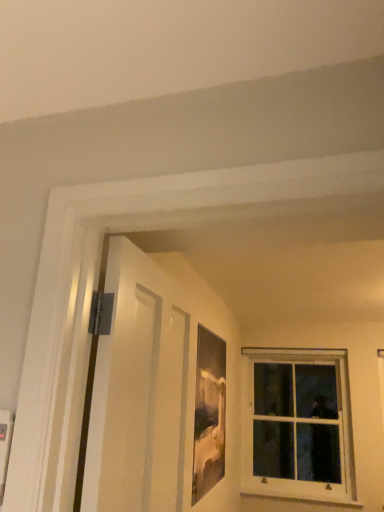
Describe the element at coordinates (297, 424) in the screenshot. The height and width of the screenshot is (512, 384). I see `white wood window at upper right` at that location.

Where is `white matte door at left`? white matte door at left is located at coordinates (138, 391).

Between matte wooden picture frame at center and white matte door at left, which one appears on the right side from the viewer's perspective?

Positioned to the right is matte wooden picture frame at center.

From the picture: From the image's perspective, is matte wooden picture frame at center located above or below white matte door at left?

matte wooden picture frame at center is situated lower than white matte door at left in the image.

Between matte wooden picture frame at center and white matte door at left, which one is positioned in front?

white matte door at left is in front.

From a real-world perspective, does matte wooden picture frame at center stand above white matte door at left?

No.

The width and height of the screenshot is (384, 512). In order to click on picture frame above the white wood window at upper right (from a real-world perspective) in this screenshot , I will do `click(209, 413)`.

Considering the positions of objects white wood window at upper right and matte wooden picture frame at center in the image provided, who is more to the left, white wood window at upper right or matte wooden picture frame at center?

From the viewer's perspective, matte wooden picture frame at center appears more on the left side.

Can you confirm if white wood window at upper right is bigger than matte wooden picture frame at center?

Yes, white wood window at upper right is bigger than matte wooden picture frame at center.

From the image's perspective, would you say white wood window at upper right is shown under matte wooden picture frame at center?

Yes.

Locate an element on the screen. This screenshot has height=512, width=384. picture frame in front of the white wood window at upper right is located at coordinates (209, 413).

Does matte wooden picture frame at center have a greater height compared to white wood window at upper right?

Incorrect, the height of matte wooden picture frame at center is not larger of that of white wood window at upper right.

Can you confirm if matte wooden picture frame at center is thinner than white wood window at upper right?

Indeed, matte wooden picture frame at center has a lesser width compared to white wood window at upper right.

Which object is further away from the camera, white wood window at upper right or white matte door at left?

white wood window at upper right is further from the camera.

Would you say white wood window at upper right is a long distance from white matte door at left?

Absolutely, white wood window at upper right is distant from white matte door at left.

Based on their sizes in the image, would you say white wood window at upper right is bigger or smaller than white matte door at left?

Clearly, white wood window at upper right is larger in size than white matte door at left.

How many degrees apart are the facing directions of white matte door at left and white wood window at upper right?

The angular difference between white matte door at left and white wood window at upper right is 89.4 degrees.

Is white matte door at left in contact with white wood window at upper right?

No, white matte door at left is not in contact with white wood window at upper right.

Is white matte door at left inside or outside of white wood window at upper right?

white matte door at left is not inside white wood window at upper right, it's outside.

Is white matte door at left positioned far away from matte wooden picture frame at center?

white matte door at left is positioned a significant distance from matte wooden picture frame at center.

Is white matte door at left oriented towards matte wooden picture frame at center?

No, white matte door at left is not facing towards matte wooden picture frame at center.

Locate an element on the screen. This screenshot has width=384, height=512. screen door on the left of matte wooden picture frame at center is located at coordinates (138, 391).

Where is `window that appears below the matte wooden picture frame at center (from a real-world perspective)`? The height and width of the screenshot is (512, 384). window that appears below the matte wooden picture frame at center (from a real-world perspective) is located at coordinates (297, 424).

Looking at the image, which one is located closer to white matte door at left, white wood window at upper right or matte wooden picture frame at center?

Based on the image, matte wooden picture frame at center appears to be nearer to white matte door at left.

Estimate the real-world distances between objects in this image. Which object is further from white wood window at upper right, matte wooden picture frame at center or white matte door at left?

Among the two, white matte door at left is located further to white wood window at upper right.

When comparing their distances from white matte door at left, does matte wooden picture frame at center or white wood window at upper right seem closer?

matte wooden picture frame at center.

Considering their positions, is white matte door at left positioned further to matte wooden picture frame at center than white wood window at upper right?

Based on the image, white wood window at upper right appears to be further to matte wooden picture frame at center.

Consider the image. When comparing their distances from matte wooden picture frame at center, does white wood window at upper right or white matte door at left seem closer?

white matte door at left lies closer to matte wooden picture frame at center than the other object.

Based on their spatial positions, is white matte door at left or matte wooden picture frame at center further from white wood window at upper right?

white matte door at left.

The height and width of the screenshot is (512, 384). Find the location of `picture frame between white matte door at left and white wood window at upper right from front to back`. picture frame between white matte door at left and white wood window at upper right from front to back is located at coordinates (209, 413).